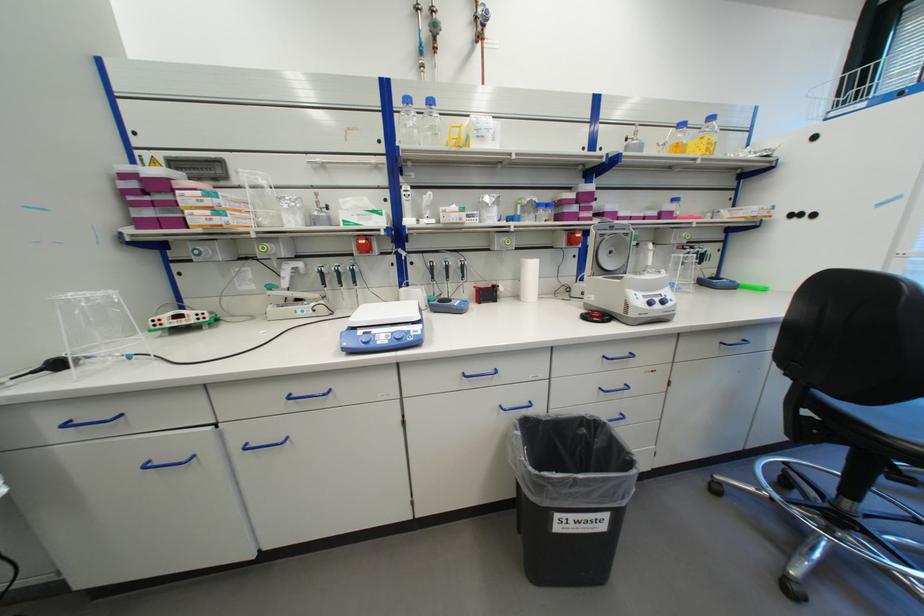
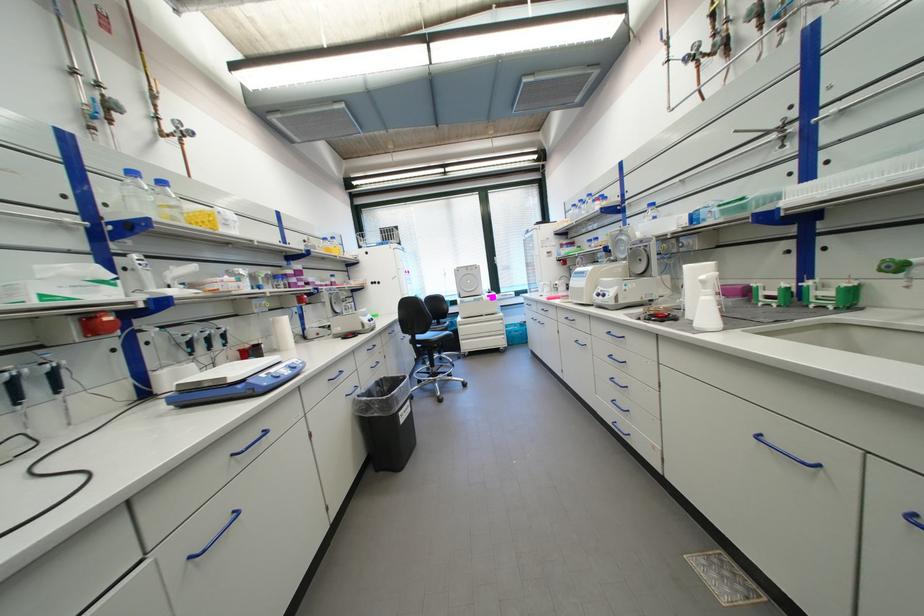
Locate, in the second image, the point that corresponds to (x=565, y=517) in the first image.

(407, 415)